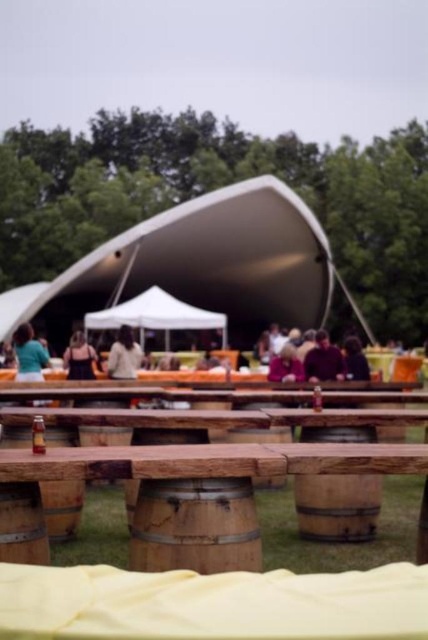
Which of these two, dark brown leather jacket at center or light beige sweater at center, stands shorter?

dark brown leather jacket at center

Who is higher up, dark brown leather jacket at center or light beige sweater at center?

Positioned higher is dark brown leather jacket at center.

You are a GUI agent. You are given a task and a screenshot of the screen. Output one action in this format:
    pyautogui.click(x=<x>, y=<y>)
    Task: Click on the dark brown leather jacket at center
    The height and width of the screenshot is (640, 428).
    Given the screenshot: What is the action you would take?
    pyautogui.click(x=323, y=360)

Is wooden barrel at center to the left of light beige sweater at center from the viewer's perspective?

No, wooden barrel at center is not to the left of light beige sweater at center.

Which is more to the left, wooden barrel at center or light beige sweater at center?

From the viewer's perspective, light beige sweater at center appears more on the left side.

Locate an element on the screen. wooden barrel at center is located at coordinates tap(195, 525).

Can you confirm if brown wooden barrel at lower left is bigger than matte black dress at center?

No, brown wooden barrel at lower left is not bigger than matte black dress at center.

Between point (44, 536) and point (70, 342), which one is positioned behind?

The point (70, 342) is behind.

At what (x,y) coordinates should I click in order to perform the action: click on brown wooden barrel at lower left. Please return your answer as a coordinate pair (x, y). Looking at the image, I should click on (21, 524).